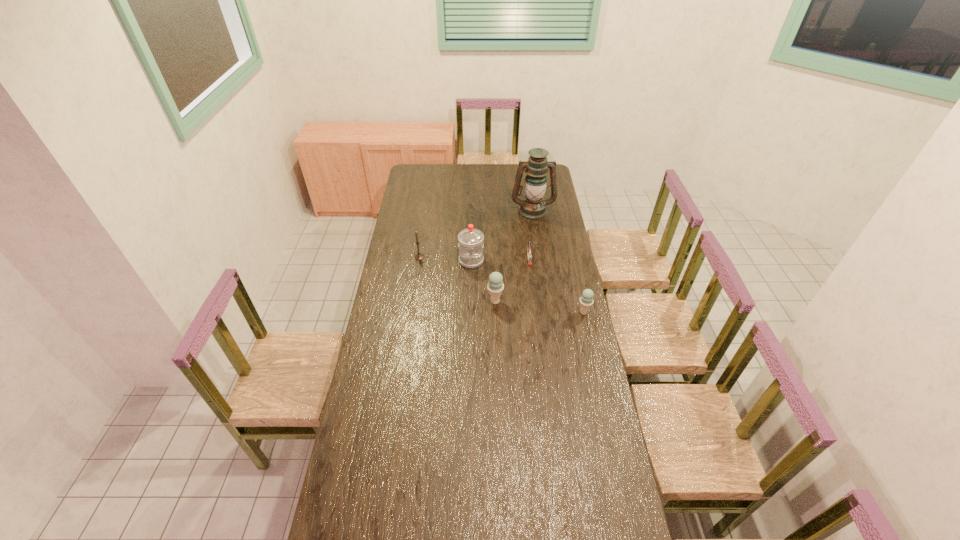
Find the location of `unoccupied area between the second tallest object and the second shortest object`. unoccupied area between the second tallest object and the second shortest object is located at coordinates (528, 287).

Identify the location of object that is the closest to the water bottle. (419, 256).

Locate an element on the screen. This screenshot has height=540, width=960. object that is the closest to the leftmost object is located at coordinates (470, 245).

At what (x,y) coordinates should I click in order to perform the action: click on free location that satisfies the following two spatial constraints: 1. on the handle side of the left ice cream; 2. on the right side of the fifth shortest object. Please return your answer as a coordinate pair (x, y). The image size is (960, 540). Looking at the image, I should click on (470, 301).

This screenshot has height=540, width=960. Identify the location of free space that satisfies the following two spatial constraints: 1. on the back side of the farthest object; 2. on the left side of the leftmost object. 426,211.

At what (x,y) coordinates should I click in order to perform the action: click on vacant space that satisfies the following two spatial constraints: 1. on the handle side of the shortest object; 2. on the right side of the second shortest object. Please return your answer as a coordinate pair (x, y). The height and width of the screenshot is (540, 960). Looking at the image, I should click on (536, 313).